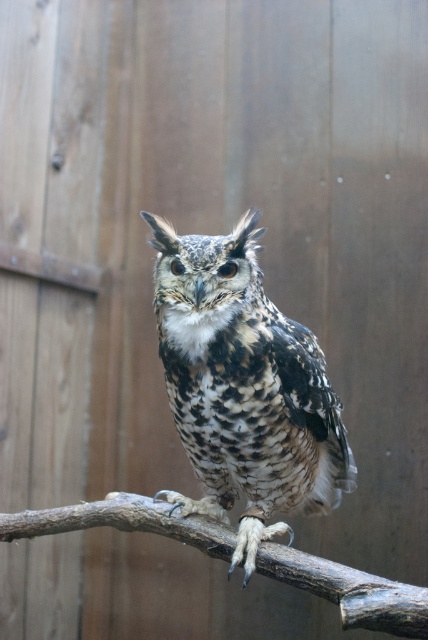
Question: Which point is farther from the camera taking this photo?

Choices:
 (A) (166, 262)
 (B) (166, 524)

Answer: (B)

Question: Does speckled feathered owl at center have a smaller size compared to brown rough tree branch at center?

Choices:
 (A) yes
 (B) no

Answer: (B)

Question: Which point is farther from the camera taking this photo?

Choices:
 (A) (371, 608)
 (B) (258, 417)

Answer: (B)

Question: Can you confirm if speckled feathered owl at center is bigger than brown rough tree branch at center?

Choices:
 (A) no
 (B) yes

Answer: (B)

Question: Does speckled feathered owl at center have a lesser width compared to brown rough tree branch at center?

Choices:
 (A) yes
 (B) no

Answer: (A)

Question: Which object is closer to the camera taking this photo?

Choices:
 (A) speckled feathered owl at center
 (B) brown rough tree branch at center

Answer: (B)